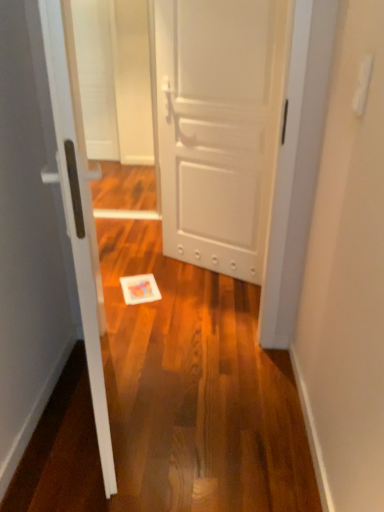
You are a GUI agent. You are given a task and a screenshot of the screen. Output one action in this format:
    pyautogui.click(x=<x>, y=<y>)
    Task: Click on the free spot below white matte door at center, which appears as the second door when viewed from the front (from a real-world perspective)
    
    Given the screenshot: What is the action you would take?
    pyautogui.click(x=207, y=269)